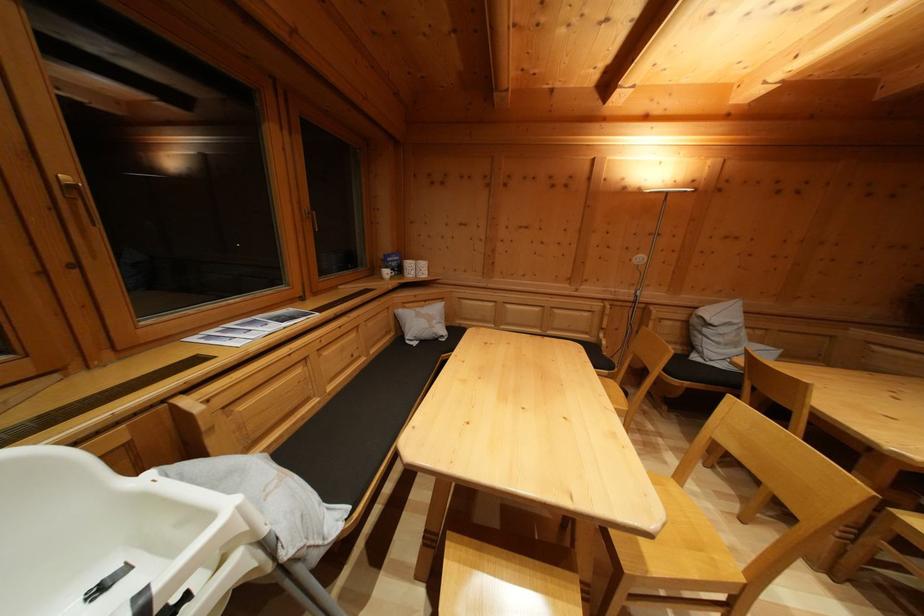
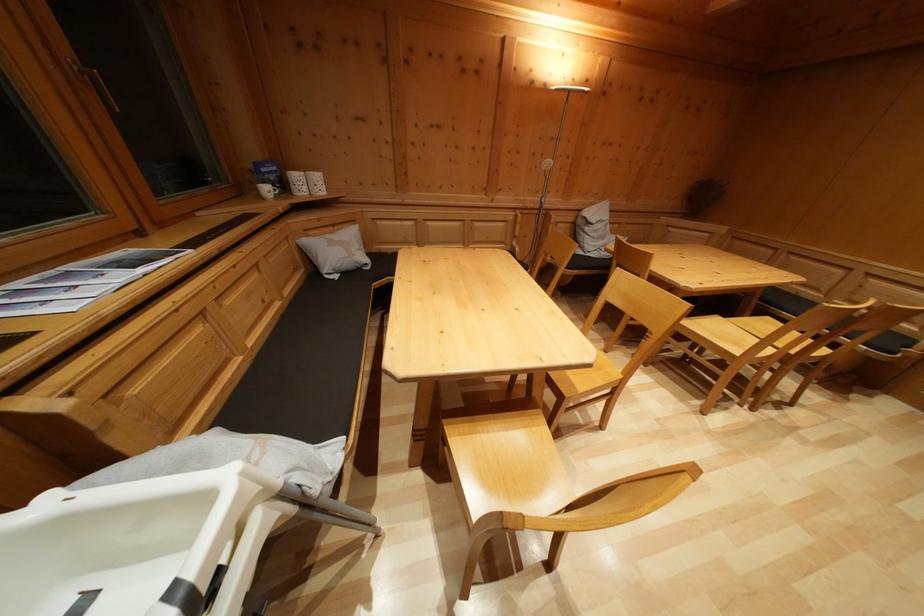
In the second image, find the point that corresponds to pixel 393 280 in the first image.

(273, 197)